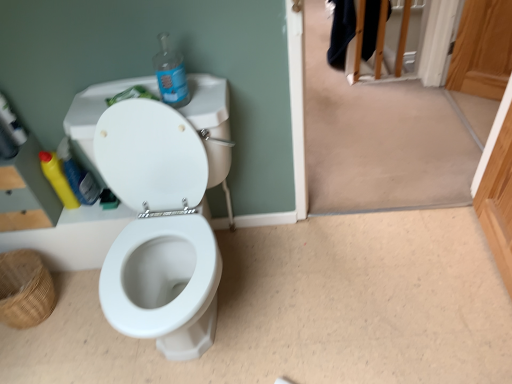
Locate an element on the screen. This screenshot has height=384, width=512. vacant space to the right of brown woven basket at lower left is located at coordinates (83, 306).